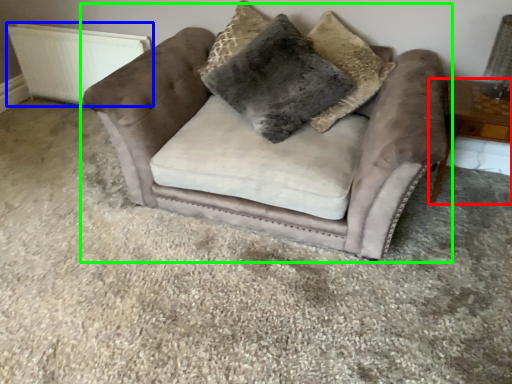
Question: Which is nearer to the table (highlighted by a red box)? radiator (highlighted by a blue box) or chair (highlighted by a green box).

Choices:
 (A) radiator
 (B) chair

Answer: (B)